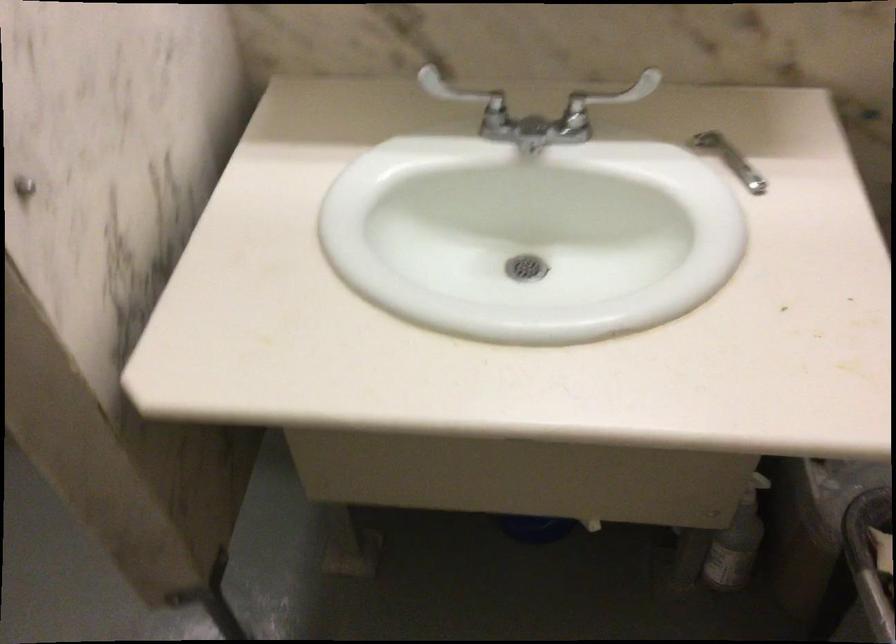
Locate an element on the screen. This screenshot has height=644, width=896. metal wrench is located at coordinates (729, 158).